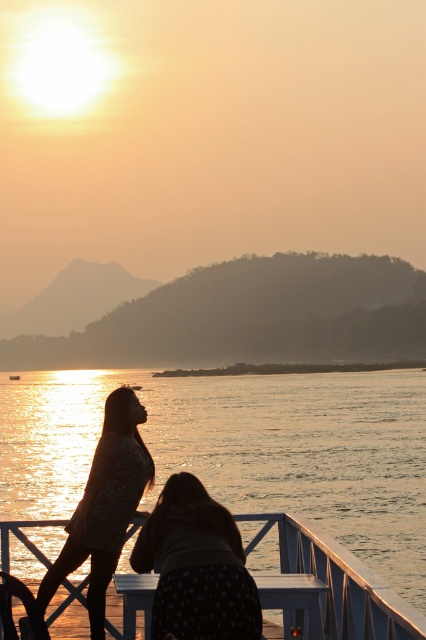
You are standing on the deck of the boat in the sunset scene. You notice a point marked at coordinates (241, 449). What does this point indicate?

The point at (241, 449) marks the location of glistening water at lower center.

You are standing on the deck of a boat and want to move to the front of the boat, which is 10 meters away. The white painted wood deck at lower center is the only path available. Can you walk safely to the front without needing to step off the deck?

The white painted wood deck at lower center is 6.09 meters from camera, so if the front of the boat is 10 meters away from your current position, the deck does not extend far enough to reach the front without stepping off.